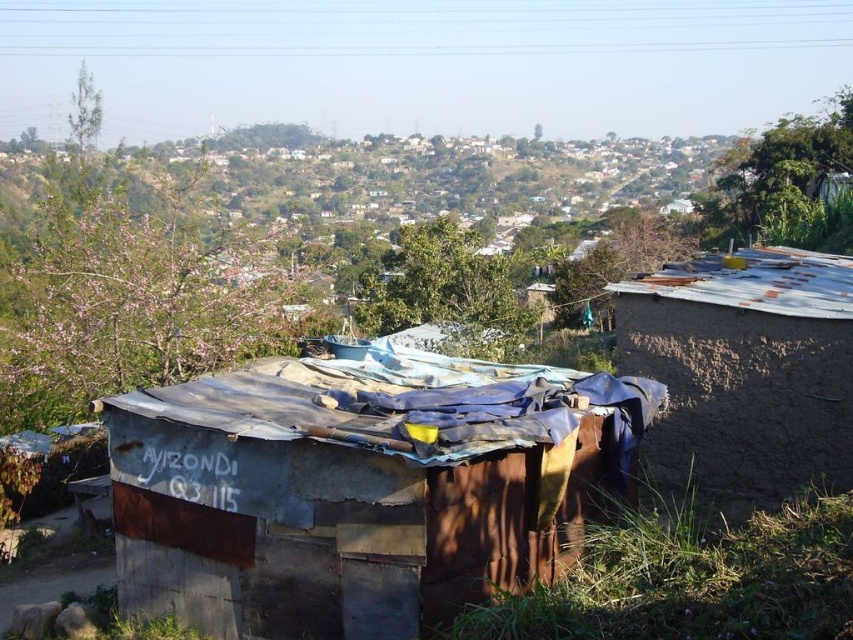
You are a delivery person needing to park your 2.5 meter wide delivery truck. You see the rusty corrugated hut at center and the brown mud hut at right. Which structure can the truck park next to without overlapping?

The rusty corrugated hut at center has a greater width than the brown mud hut at right, so the truck can park next to the rusty corrugated hut at center since it is wider and likely has more space available.

You are standing at the point marked with coordinates point (355, 499) in the image. What structure are you facing?

The point (355, 499) indicates rusty corrugated hut at center, so you are facing the rusty corrugated hut at center.

You are a delivery person trying to reach the brown mud hut at right. There is a rusty corrugated hut at center blocking your path. Can you walk around it to the right side?

The rusty corrugated hut at center is in front of the brown mud hut at right, so you can walk around the rusty corrugated hut at center to the right side to reach the brown mud hut at right.